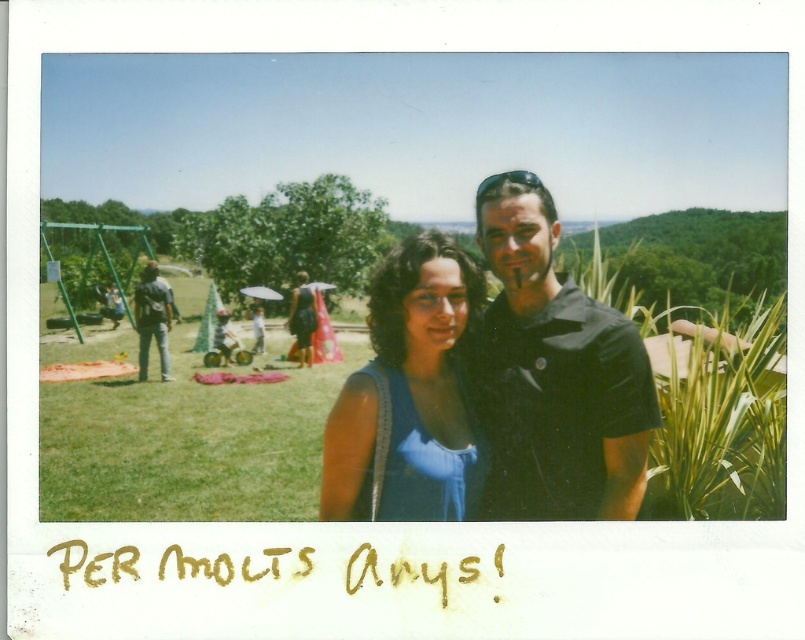
Which of these two, blue satin dress at center or denim jeans at left, stands taller?

Standing taller between the two is denim jeans at left.

Which is above, blue satin dress at center or denim jeans at left?

denim jeans at left is above.

Does point (411, 240) lie in front of point (164, 292)?

Yes, it is in front of point (164, 292).

Image resolution: width=805 pixels, height=640 pixels. In order to click on blue satin dress at center in this screenshot , I will do `click(407, 396)`.

Is black matte shirt at center closer to camera compared to blue satin dress at center?

No.

Does black matte shirt at center have a greater width compared to blue satin dress at center?

Indeed, black matte shirt at center has a greater width compared to blue satin dress at center.

The width and height of the screenshot is (805, 640). In order to click on black matte shirt at center in this screenshot , I will do `click(555, 371)`.

Between matte blue dress at center and denim jeans at left, which one is positioned lower?

Positioned lower is denim jeans at left.

Who is more forward, [167,518] or [145,346]?

Point [167,518]

You are a GUI agent. You are given a task and a screenshot of the screen. Output one action in this format:
    pyautogui.click(x=<x>, y=<y>)
    Task: Click on the matte blue dress at center
    This screenshot has height=640, width=805.
    Given the screenshot: What is the action you would take?
    pyautogui.click(x=630, y=378)